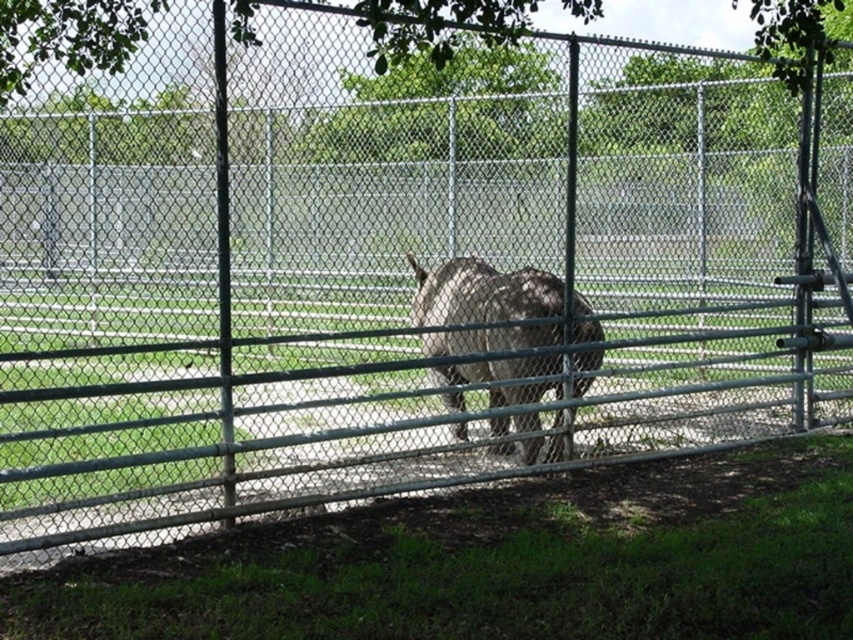
Is green leafy tree at upper center taller than gray fur at center?

Incorrect, green leafy tree at upper center's height is not larger of gray fur at center's.

Which is in front, point (407, 129) or point (432, 300)?

Point (407, 129) is more forward.

This screenshot has width=853, height=640. I want to click on green leafy tree at upper center, so coord(444,108).

This screenshot has width=853, height=640. What are the coordinates of `green leafy tree at upper center` in the screenshot? It's located at (444, 108).